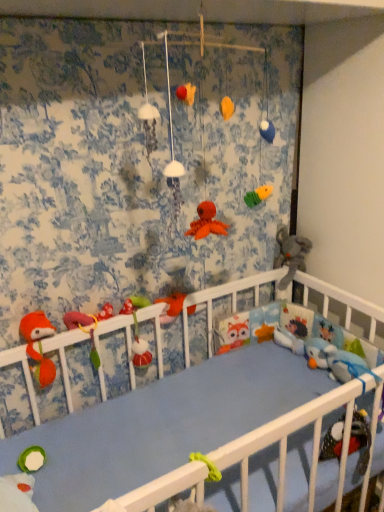
Describe the element at coordinates (137, 332) in the screenshot. I see `fuzzy fabric toy at center, which is the 3th toy in left-to-right order` at that location.

Locate an element on the screen. Image resolution: width=384 pixels, height=512 pixels. fluffy orange fox at left, which ranks as the 6th toy in right-to-left order is located at coordinates (38, 345).

You are a GUI agent. You are given a task and a screenshot of the screen. Output one action in this format:
    pyautogui.click(x=<x>, y=<y>)
    Task: Click on the gray plush elephant at right, the 1th toy when ordered from right to left
    This screenshot has width=384, height=512.
    Given the screenshot: What is the action you would take?
    pyautogui.click(x=291, y=254)

Where is `fuzzy fabric toy at center, acting as the 4th toy starting from the right`? This screenshot has height=512, width=384. fuzzy fabric toy at center, acting as the 4th toy starting from the right is located at coordinates (137, 332).

From a real-world perspective, is fluffy orange fox at left, which ranks as the 6th toy in right-to-left order, positioned above or below blue plush toy at right, the 2th toy positioned from the right?

fluffy orange fox at left, which ranks as the 6th toy in right-to-left order, is above blue plush toy at right, the 2th toy positioned from the right.

Could you tell me if fluffy orange fox at left, placed as the 1th toy when sorted from left to right, is facing blue plush toy at right, the 2th toy positioned from the right?

No, fluffy orange fox at left, placed as the 1th toy when sorted from left to right, is not aimed at blue plush toy at right, the 2th toy positioned from the right.

Does fluffy orange fox at left, placed as the 1th toy when sorted from left to right, come behind blue plush toy at right, the 2th toy positioned from the right?

No, fluffy orange fox at left, placed as the 1th toy when sorted from left to right, is in front of blue plush toy at right, the 2th toy positioned from the right.

Does fluffy orange fox at left, placed as the 1th toy when sorted from left to right, have a smaller size compared to blue plush toy at right, the 2th toy positioned from the right?

No.

Find the location of a particular element. The height and width of the screenshot is (512, 384). the 1st toy above the fuzzy fabric toy at center, which is the 3th toy in left-to-right order (from the image's perspective) is located at coordinates (88, 327).

Which is farther from the camera, (98, 364) or (148, 362)?

The point (148, 362) is more distant.

Looking at their sizes, would you say matte green plush toy at center, marked as the second toy in a left-to-right arrangement, is wider or thinner than fuzzy fabric toy at center, which is the 3th toy in left-to-right order?

In the image, matte green plush toy at center, marked as the second toy in a left-to-right arrangement, appears to be more narrow than fuzzy fabric toy at center, which is the 3th toy in left-to-right order.

Is matte green plush toy at center, marked as the second toy in a left-to-right arrangement, positioned with its back to fuzzy fabric toy at center, acting as the 4th toy starting from the right?

No, matte green plush toy at center, marked as the second toy in a left-to-right arrangement, is not facing the opposite direction of fuzzy fabric toy at center, acting as the 4th toy starting from the right.

Is fuzzy fabric toy at center, which is the 3th toy in left-to-right order, not inside fluffy orange fox at left, placed as the 1th toy when sorted from left to right?

Yes, fuzzy fabric toy at center, which is the 3th toy in left-to-right order, is not within fluffy orange fox at left, placed as the 1th toy when sorted from left to right.

From the picture: Is fuzzy fabric toy at center, acting as the 4th toy starting from the right, oriented towards fluffy orange fox at left, placed as the 1th toy when sorted from left to right?

No, fuzzy fabric toy at center, acting as the 4th toy starting from the right, is not turned towards fluffy orange fox at left, placed as the 1th toy when sorted from left to right.

Considering the positions of point (136, 303) and point (35, 373), is point (136, 303) closer or farther from the camera than point (35, 373)?

Point (136, 303).

Can you confirm if fuzzy fabric toy at center, acting as the 4th toy starting from the right, is shorter than fluffy orange fox at left, which ranks as the 6th toy in right-to-left order?

No, fuzzy fabric toy at center, acting as the 4th toy starting from the right, is not shorter than fluffy orange fox at left, which ranks as the 6th toy in right-to-left order.

Could you tell me if blue plush toy at right, the fifth toy when ordered from left to right, is facing fuzzy fabric toy at center, which is the 3th toy in left-to-right order?

Yes, blue plush toy at right, the fifth toy when ordered from left to right, faces towards fuzzy fabric toy at center, which is the 3th toy in left-to-right order.

Consider the image. Between blue plush toy at right, the 2th toy positioned from the right, and fuzzy fabric toy at center, which is the 3th toy in left-to-right order, which one has smaller size?

Smaller between the two is blue plush toy at right, the 2th toy positioned from the right.

From a real-world perspective, which is physically below, blue plush toy at right, the 2th toy positioned from the right, or fuzzy fabric toy at center, acting as the 4th toy starting from the right?

blue plush toy at right, the 2th toy positioned from the right.

Is fuzzy fabric toy at center, acting as the 4th toy starting from the right, inside blue plush toy at right, the 2th toy positioned from the right?

No, fuzzy fabric toy at center, acting as the 4th toy starting from the right, is not surrounded by blue plush toy at right, the 2th toy positioned from the right.

Who is taller, matte orange plush at center, which ranks as the third toy in right-to-left order, or matte green plush toy at center, marked as the second toy in a left-to-right arrangement?

With more height is matte green plush toy at center, marked as the second toy in a left-to-right arrangement.

From a real-world perspective, which is physically above, matte orange plush at center, which is counted as the fourth toy, starting from the left, or matte green plush toy at center, which is counted as the 5th toy, starting from the right?

In real-world perspective, matte green plush toy at center, which is counted as the 5th toy, starting from the right, is above.

Which of these two, matte orange plush at center, which is counted as the fourth toy, starting from the left, or matte green plush toy at center, which is counted as the 5th toy, starting from the right, is wider?

With larger width is matte orange plush at center, which is counted as the fourth toy, starting from the left.

Would you consider fluffy orange fox at left, which ranks as the 6th toy in right-to-left order, to be distant from matte green plush toy at center, marked as the second toy in a left-to-right arrangement?

No, fluffy orange fox at left, which ranks as the 6th toy in right-to-left order, is not far away from matte green plush toy at center, marked as the second toy in a left-to-right arrangement.

From a real-world perspective, which object rests below the other?

In real-world perspective, fluffy orange fox at left, placed as the 1th toy when sorted from left to right, is lower.

Which is more to the right, fluffy orange fox at left, placed as the 1th toy when sorted from left to right, or matte green plush toy at center, which is counted as the 5th toy, starting from the right?

matte green plush toy at center, which is counted as the 5th toy, starting from the right.

From the picture: From the image's perspective, between fluffy orange fox at left, which ranks as the 6th toy in right-to-left order, and matte green plush toy at center, marked as the second toy in a left-to-right arrangement, which one is located above?

matte green plush toy at center, marked as the second toy in a left-to-right arrangement, is shown above in the image.

Is matte green plush toy at center, which is counted as the 5th toy, starting from the right, with blue plush toy at right, the fifth toy when ordered from left to right?

There is a gap between matte green plush toy at center, which is counted as the 5th toy, starting from the right, and blue plush toy at right, the fifth toy when ordered from left to right.

Which object is closer to the camera taking this photo, matte green plush toy at center, which is counted as the 5th toy, starting from the right, or blue plush toy at right, the fifth toy when ordered from left to right?

Positioned in front is matte green plush toy at center, which is counted as the 5th toy, starting from the right.

Based on the photo, is matte green plush toy at center, marked as the second toy in a left-to-right arrangement, spatially inside blue plush toy at right, the fifth toy when ordered from left to right, or outside of it?

matte green plush toy at center, marked as the second toy in a left-to-right arrangement, is outside blue plush toy at right, the fifth toy when ordered from left to right.

Find the location of a particular element. the 3rd toy to the right when counting from the matte green plush toy at center, which is counted as the 5th toy, starting from the right is located at coordinates (280, 338).

Starting from the fluffy orange fox at left, which ranks as the 6th toy in right-to-left order, which toy is the 4th one to the right? Please provide its 2D coordinates.

[(280, 338)]

Starting from the fuzzy fabric toy at center, acting as the 4th toy starting from the right, which toy is the 1st one to the left? Please provide its 2D coordinates.

[(88, 327)]

Based on their spatial positions, is blue plush toy at right, the 2th toy positioned from the right, or matte orange plush at center, which is counted as the fourth toy, starting from the left, closer to fluffy orange fox at left, placed as the 1th toy when sorted from left to right?

matte orange plush at center, which is counted as the fourth toy, starting from the left.

From the image, which object appears to be nearer to blue plush toy at right, the 2th toy positioned from the right, fuzzy fabric toy at center, acting as the 4th toy starting from the right, or matte orange plush at center, which ranks as the third toy in right-to-left order?

matte orange plush at center, which ranks as the third toy in right-to-left order, lies closer to blue plush toy at right, the 2th toy positioned from the right, than the other object.

When comparing their distances from gray plush elephant at right, the 1th toy when ordered from right to left, does fuzzy fabric toy at center, acting as the 4th toy starting from the right, or fluffy orange fox at left, placed as the 1th toy when sorted from left to right, seem further?

fluffy orange fox at left, placed as the 1th toy when sorted from left to right.

Estimate the real-world distances between objects in this image. Which object is closer to fuzzy fabric toy at center, which is the 3th toy in left-to-right order, blue plush toy at right, the 2th toy positioned from the right, or matte green plush toy at center, which is counted as the 5th toy, starting from the right?

matte green plush toy at center, which is counted as the 5th toy, starting from the right, is positioned closer to the anchor fuzzy fabric toy at center, which is the 3th toy in left-to-right order.

Based on their spatial positions, is matte orange plush at center, which is counted as the fourth toy, starting from the left, or gray plush elephant at right, positioned as the 6th toy in left-to-right order, closer to fuzzy fabric toy at center, acting as the 4th toy starting from the right?

matte orange plush at center, which is counted as the fourth toy, starting from the left, is closer to fuzzy fabric toy at center, acting as the 4th toy starting from the right.

When comparing their distances from fuzzy fabric toy at center, which is the 3th toy in left-to-right order, does blue plush toy at right, the 2th toy positioned from the right, or fluffy orange fox at left, which ranks as the 6th toy in right-to-left order, seem closer?

Based on the image, fluffy orange fox at left, which ranks as the 6th toy in right-to-left order, appears to be nearer to fuzzy fabric toy at center, which is the 3th toy in left-to-right order.

Based on their spatial positions, is matte green plush toy at center, which is counted as the 5th toy, starting from the right, or gray plush elephant at right, the 1th toy when ordered from right to left, further from blue plush toy at right, the 2th toy positioned from the right?

matte green plush toy at center, which is counted as the 5th toy, starting from the right, is positioned further to the anchor blue plush toy at right, the 2th toy positioned from the right.

Looking at the image, which one is located closer to gray plush elephant at right, the 1th toy when ordered from right to left, blue plush toy at right, the 2th toy positioned from the right, or matte green plush toy at center, which is counted as the 5th toy, starting from the right?

blue plush toy at right, the 2th toy positioned from the right, is positioned closer to the anchor gray plush elephant at right, the 1th toy when ordered from right to left.

Find the location of a particular element. toy between matte green plush toy at center, which is counted as the 5th toy, starting from the right, and matte orange plush at center, which is counted as the fourth toy, starting from the left, from left to right is located at coordinates (137, 332).

Where is `toy between fuzzy fabric toy at center, acting as the 4th toy starting from the right, and blue plush toy at right, the 2th toy positioned from the right`? The height and width of the screenshot is (512, 384). toy between fuzzy fabric toy at center, acting as the 4th toy starting from the right, and blue plush toy at right, the 2th toy positioned from the right is located at coordinates (171, 307).

I want to click on toy located between fluffy orange fox at left, which ranks as the 6th toy in right-to-left order, and fuzzy fabric toy at center, acting as the 4th toy starting from the right, in the left-right direction, so click(88, 327).

You are a GUI agent. You are given a task and a screenshot of the screen. Output one action in this format:
    pyautogui.click(x=<x>, y=<y>)
    Task: Click on the toy between matte orange plush at center, which ranks as the third toy in right-to-left order, and gray plush elephant at right, the 1th toy when ordered from right to left, in the horizontal direction
    The image size is (384, 512).
    Given the screenshot: What is the action you would take?
    pyautogui.click(x=280, y=338)